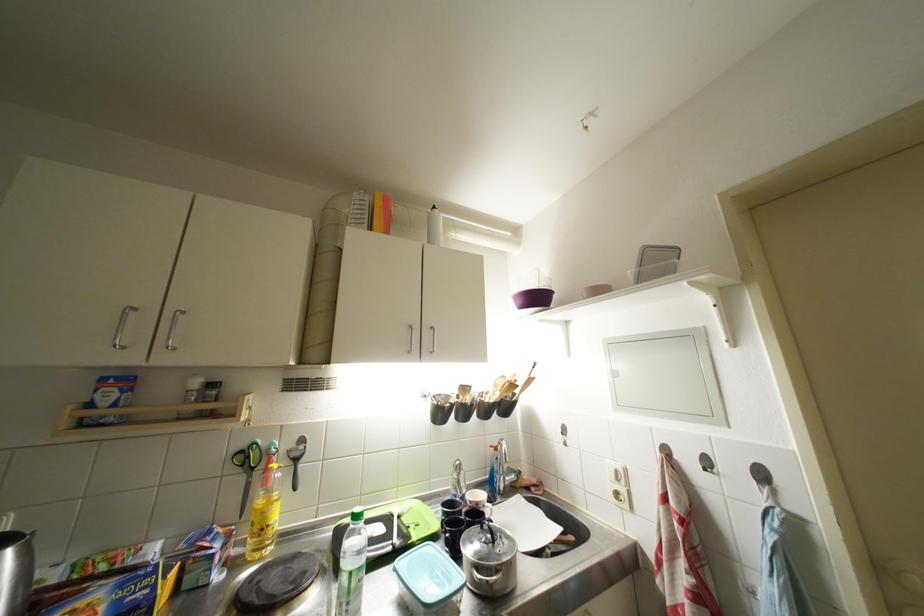
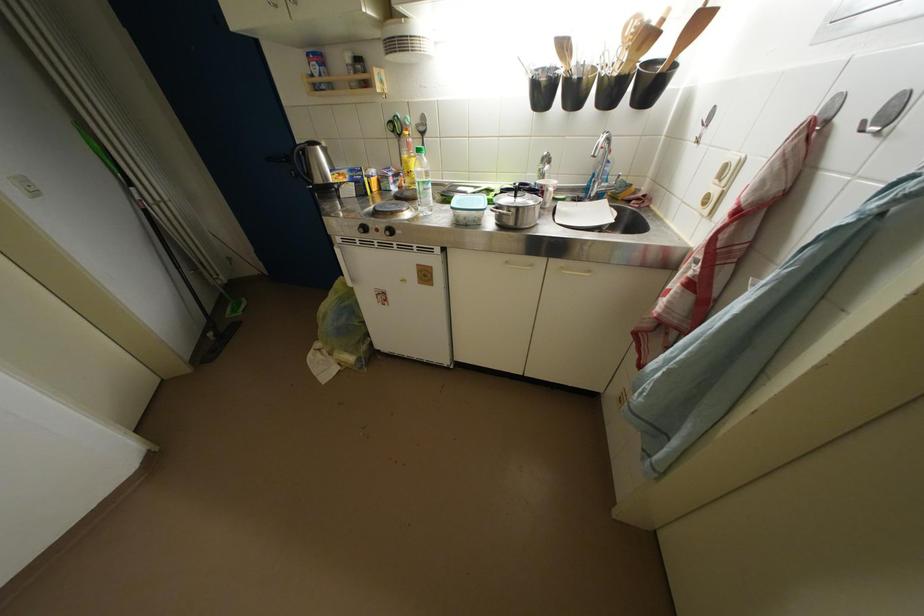
In the second image, find the point that corresponds to [271,517] in the first image.

(412, 167)